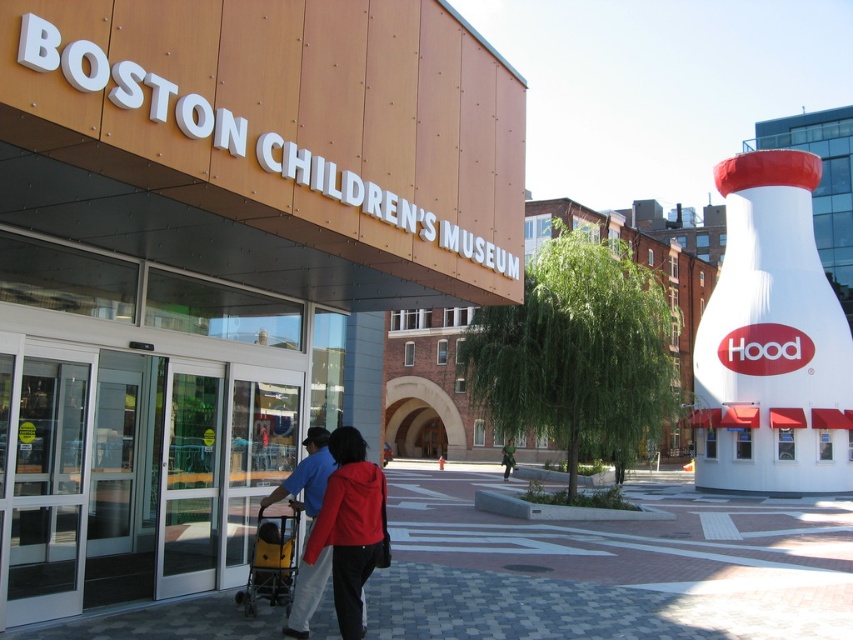
Question: Which object appears closest to the camera in this image?

Choices:
 (A) yellow plastic baby carriage at lower left
 (B) matte blue shirt at center
 (C) matte red jacket at center

Answer: (C)

Question: Is matte blue shirt at center above yellow plastic baby carriage at lower left?

Choices:
 (A) no
 (B) yes

Answer: (B)

Question: Is matte red jacket at center thinner than yellow plastic baby carriage at lower left?

Choices:
 (A) yes
 (B) no

Answer: (A)

Question: Which of the following is the closest to the observer?

Choices:
 (A) yellow plastic baby carriage at lower left
 (B) matte blue shirt at center
 (C) matte red jacket at center

Answer: (C)

Question: Which point is farther from the camera taking this photo?

Choices:
 (A) (329, 461)
 (B) (346, 572)
 (C) (242, 596)

Answer: (C)

Question: Is matte red jacket at center below yellow plastic baby carriage at lower left?

Choices:
 (A) yes
 (B) no

Answer: (B)